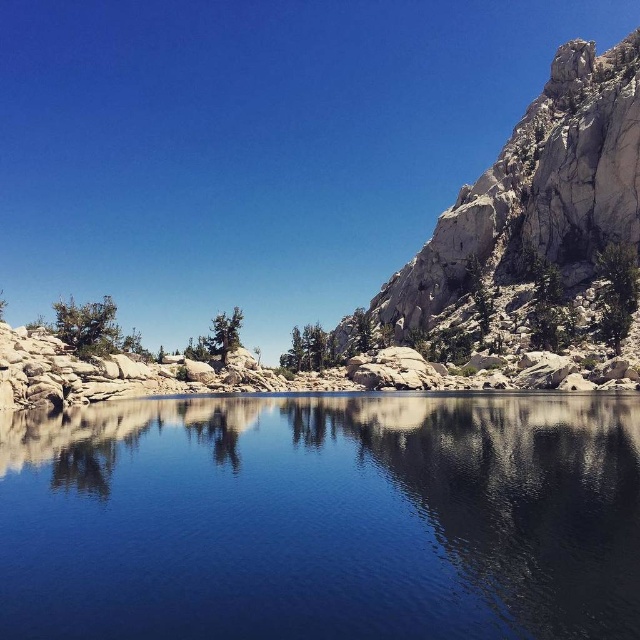
You are standing at the edge of the water in the serene landscape. You see two points marked in the image. Which point is closer to you, point (323,602) or point (444,259)?

Point (323,602) is in front of point (444,259), so it is closer to you.

You are standing on the rocky shoreline and want to take a photo of the rugged stone mountain at right. However, you notice that the transparent glass water at center is blocking your view. To get a clear shot, should you move to your left or right?

You should move to your right. The transparent glass water at center is blocking the view of the rugged stone mountain at right, which is located to the right of the water. Moving to your right would allow you to position yourself beyond the water obstruction.

You are a hiker who wants to take a photo of the rugged stone mountain at right. However, you notice the transparent glass water at center is in the way. Can you see the mountain through the water?

The transparent glass water at center is positioned under rugged stone mountain at right, so yes, you can see the mountain through the transparent glass water at center because it is transparent and located beneath the mountain.